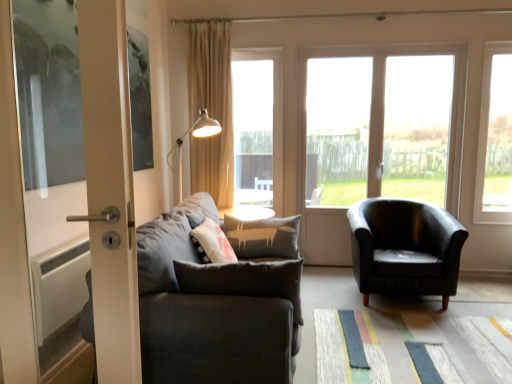
Question: From a real-world perspective, relative to beige fabric curtain at upper center, is transparent glass window at center, which is counted as the 4th window, starting from the right, vertically above or below?

Choices:
 (A) below
 (B) above

Answer: (A)

Question: Is point (266, 84) closer or farther from the camera than point (209, 82)?

Choices:
 (A) farther
 (B) closer

Answer: (A)

Question: Which is farther from the transparent glass window at center, which is counted as the 4th window, starting from the right?

Choices:
 (A) textured multicolored mat at lower center
 (B) transparent glass window at center
 (C) dark gray fabric couch at left
 (D) transparent glass window at center, which ranks as the 3th window in right-to-left order
 (E) matte black armchair at center right

Answer: (C)

Question: Considering the real-world distances, which object is closest to the dark gray fabric couch at left?

Choices:
 (A) transparent glass window at center
 (B) transparent glass window at right, the fourth window viewed from the left
 (C) matte black armchair at center right
 (D) transparent glass window at center, the 1th window viewed from the left
 (E) transparent glass door at center, which ranks as the 2th window in right-to-left order

Answer: (C)